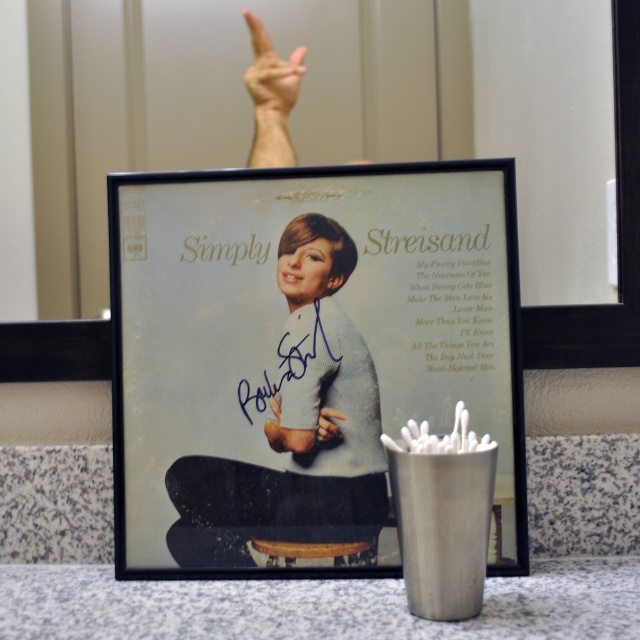
You are an interior designer arranging items on a countertop. You have a matte black picture frame at center. Where should you place it to align with the existing layout?

The matte black picture frame at center should be placed at point (307, 358) to align with the existing layout.

You are a photographer adjusting lighting for a photo shoot. You need to ensure that the matte black picture frame at center and the matte black hand at upper center are both well lit. Which object should you focus your light on first if the hand needs to be brighter than the frame?

The matte black hand at upper center needs to be brighter than the matte black picture frame at center, so you should focus the light on the matte black hand at upper center first.